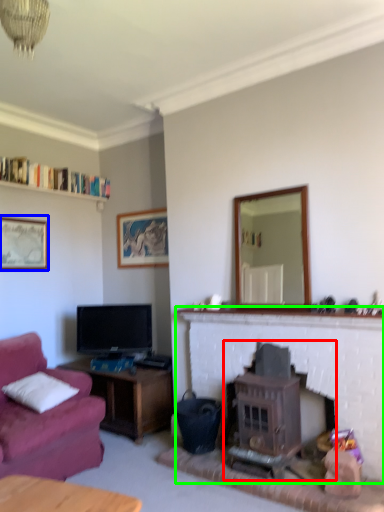
Question: Which object is positioned closest to wood burning stove (highlighted by a red box)? Select from picture frame (highlighted by a blue box) and fireplace (highlighted by a green box).

Choices:
 (A) picture frame
 (B) fireplace

Answer: (B)